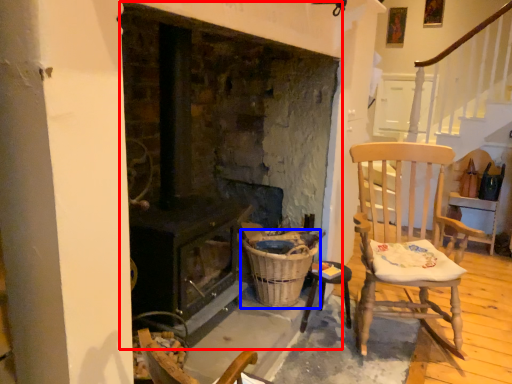
Question: Which of the following is the closest to the observer, fireplace (highlighted by a red box) or basket (highlighted by a blue box)?

Choices:
 (A) fireplace
 (B) basket

Answer: (A)